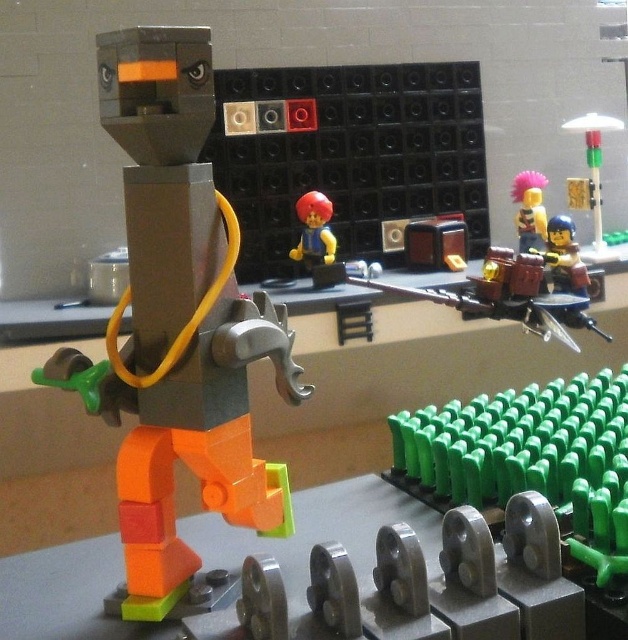
Question: Which object is positioned closest to the brick-like yellow figure at center?

Choices:
 (A) shiny pink hair at upper right
 (B) matte plastic minifigure at upper right
 (C) matte gray figure at center

Answer: (A)

Question: From the image, what is the correct spatial relationship of translucent green plastic traffic light at upper right in relation to shiny pink hair at upper right?

Choices:
 (A) right
 (B) left

Answer: (A)

Question: Does translucent green plastic traffic light at upper right have a larger size compared to matte plastic minifigure at upper right?

Choices:
 (A) no
 (B) yes

Answer: (B)

Question: Which of the following is the farthest from the observer?

Choices:
 (A) (587, 275)
 (B) (543, 218)
 (C) (168, 532)

Answer: (B)

Question: Among these objects, which one is nearest to the camera?

Choices:
 (A) shiny pink hair at upper right
 (B) translucent green plastic traffic light at upper right
 (C) matte plastic minifigure at upper right

Answer: (C)

Question: Is translucent green plastic traffic light at upper right above brick-like yellow figure at center?

Choices:
 (A) no
 (B) yes

Answer: (B)